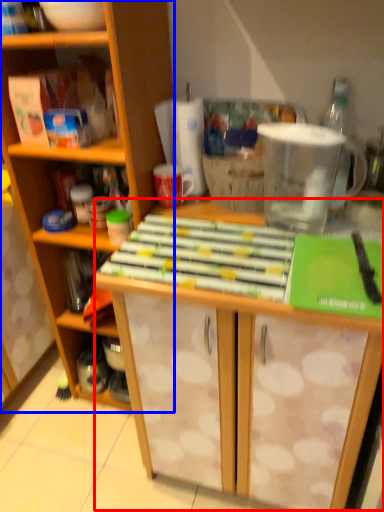
Question: Which of the following is the farthest to the observer, table (highlighted by a red box) or cabinetry (highlighted by a blue box)?

Choices:
 (A) table
 (B) cabinetry

Answer: (B)